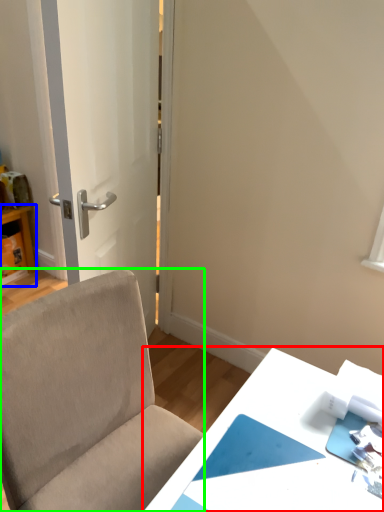
Question: Which object is positioned farthest from table (highlighted by a red box)? Select from table (highlighted by a blue box) and chair (highlighted by a green box).

Choices:
 (A) table
 (B) chair

Answer: (A)